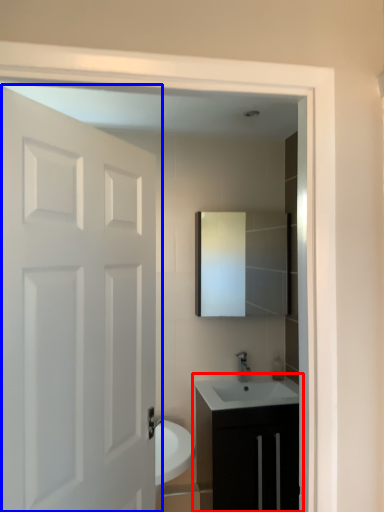
Question: Which point is further to the camera, bathroom cabinet (highlighted by a red box) or door (highlighted by a blue box)?

Choices:
 (A) bathroom cabinet
 (B) door

Answer: (A)